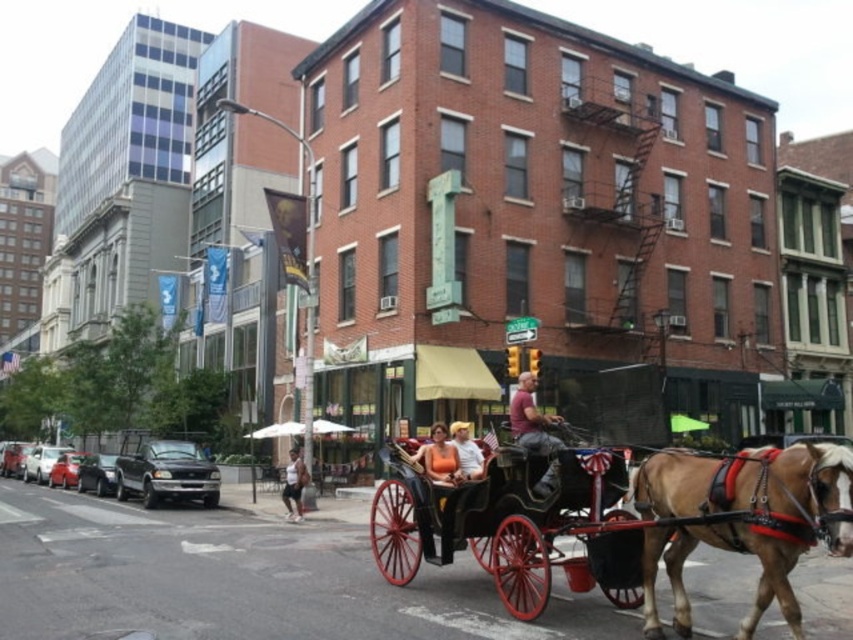
Which is more to the right, wooden polished horse cart at center or orange fabric shirt at center?

From the viewer's perspective, wooden polished horse cart at center appears more on the right side.

Where is `wooden polished horse cart at center`? This screenshot has width=853, height=640. wooden polished horse cart at center is located at coordinates (x=613, y=518).

The width and height of the screenshot is (853, 640). What are the coordinates of `wooden polished horse cart at center` in the screenshot? It's located at (613, 518).

Who is more distant from viewer, (570, 515) or (844, 476)?

The point (570, 515) is behind.

The image size is (853, 640). Identify the location of wooden polished horse cart at center. (613, 518).

Can you confirm if orange fabric shirt at center is positioned to the left of white tank top at center?

No, orange fabric shirt at center is not to the left of white tank top at center.

Does orange fabric shirt at center have a larger size compared to white tank top at center?

Actually, orange fabric shirt at center might be smaller than white tank top at center.

Find the location of a particular element. This screenshot has height=640, width=853. orange fabric shirt at center is located at coordinates (438, 458).